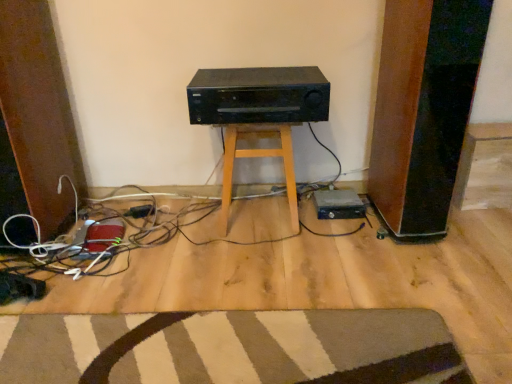
Locate an element on the screen. The height and width of the screenshot is (384, 512). blank space to the left of black plastic hard drive at lower right is located at coordinates (290, 213).